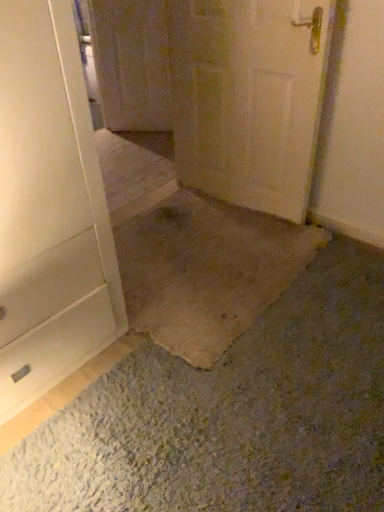
The image size is (384, 512). Describe the element at coordinates (249, 98) in the screenshot. I see `white matte door at center` at that location.

Locate an element on the screen. white matte door at center is located at coordinates (249, 98).

Locate an element on the screen. This screenshot has height=512, width=384. white matte door at center is located at coordinates (249, 98).